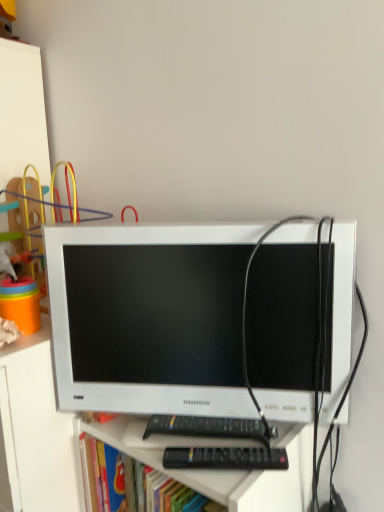
Question: From the image's perspective, is white glossy computer monitor at center located above or below plastic rainbow rings at left?

Choices:
 (A) above
 (B) below

Answer: (B)

Question: From a real-world perspective, is white glossy computer monitor at center above or below plastic rainbow rings at left?

Choices:
 (A) below
 (B) above

Answer: (A)

Question: Which of these objects is positioned closest to the white matte file cabinet at left?

Choices:
 (A) white glossy computer monitor at center
 (B) black plastic remote at lower center
 (C) plastic rainbow rings at left

Answer: (A)

Question: Which is farther from the plastic rainbow rings at left?

Choices:
 (A) black plastic remote at lower center
 (B) white matte file cabinet at left
 (C) white glossy computer monitor at center

Answer: (A)